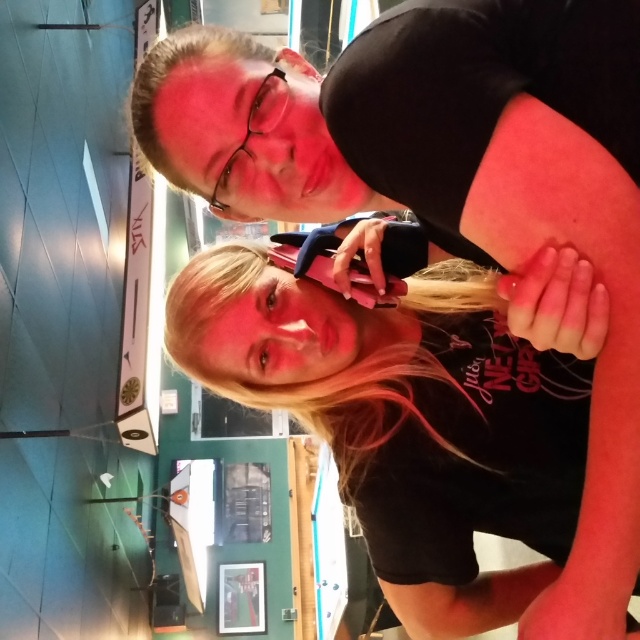
Is blonde hair at center taller than blonde hair at upper center?

Indeed, blonde hair at center has a greater height compared to blonde hair at upper center.

Between blonde hair at center and blonde hair at upper center, which one appears on the right side from the viewer's perspective?

From the viewer's perspective, blonde hair at center appears more on the right side.

Is point (289, 397) closer to camera compared to point (163, 68)?

That is False.

Find the location of a particular element. This screenshot has width=640, height=640. blonde hair at center is located at coordinates (332, 371).

Who is positioned more to the left, black matte phone at center or blonde hair at center?

Positioned to the left is blonde hair at center.

Does black matte phone at center have a greater height compared to blonde hair at center?

Yes, black matte phone at center is taller than blonde hair at center.

Which is behind, point (324, 353) or point (369, 355)?

Positioned behind is point (369, 355).

You are a GUI agent. You are given a task and a screenshot of the screen. Output one action in this format:
    pyautogui.click(x=<x>, y=<y>)
    Task: Click on the black matte phone at center
    The image size is (640, 640).
    Given the screenshot: What is the action you would take?
    (x=417, y=410)

At what (x,y) coordinates should I click in order to perform the action: click on black matte phone at center. Please return your answer as a coordinate pair (x, y). This screenshot has height=640, width=640. Looking at the image, I should click on (417, 410).

Is point (496, 422) positioned behind point (211, 51)?

That is True.

Who is more distant from viewer, (x=305, y=404) or (x=180, y=177)?

The point (x=305, y=404) is more distant.

You are a GUI agent. You are given a task and a screenshot of the screen. Output one action in this format:
    pyautogui.click(x=<x>, y=<y>)
    Task: Click on the black matte phone at center
    
    Given the screenshot: What is the action you would take?
    pyautogui.click(x=417, y=410)